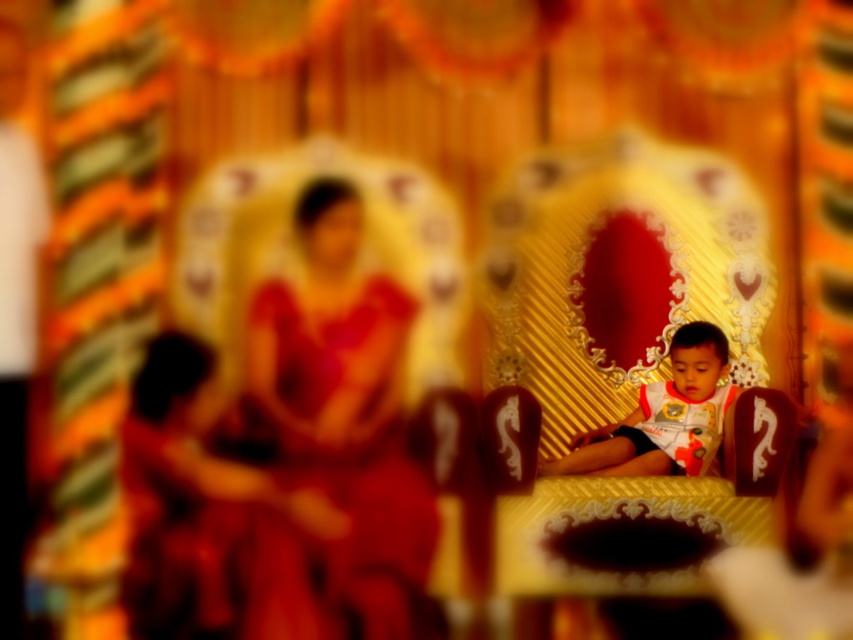
Question: Considering the real-world distances, which object is closest to the matte red robe at center?

Choices:
 (A) white printed shirt at center
 (B) matte red dress at left

Answer: (B)

Question: From the image, what is the correct spatial relationship of matte red robe at center in relation to white printed shirt at center?

Choices:
 (A) right
 (B) left

Answer: (B)

Question: Which point appears closest to the camera in this image?

Choices:
 (A) (373, 410)
 (B) (155, 572)
 (C) (624, 426)

Answer: (B)

Question: In this image, where is matte red robe at center located relative to white printed shirt at center?

Choices:
 (A) above
 (B) below

Answer: (B)

Question: Is matte red robe at center further to the viewer compared to white printed shirt at center?

Choices:
 (A) no
 (B) yes

Answer: (A)

Question: Among these objects, which one is nearest to the camera?

Choices:
 (A) matte red dress at left
 (B) matte red robe at center

Answer: (B)